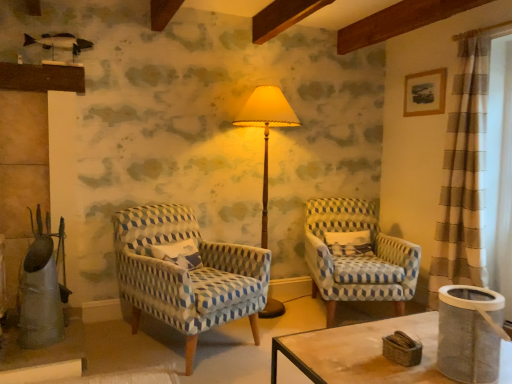
The height and width of the screenshot is (384, 512). What do you see at coordinates (357, 256) in the screenshot?
I see `blue patterned fabric chair at center, which is the second chair from left to right` at bounding box center [357, 256].

What is the approximate width of white textured pillow at center?

It is 4.89 inches.

What is the approximate width of white mesh screen at right?

white mesh screen at right is 28.78 centimeters in width.

This screenshot has height=384, width=512. Identify the location of white mesh screen at right. (499, 172).

The image size is (512, 384). In order to click on blue patterned fabric chair at center, marked as the 1th chair in a left-to-right arrangement in this screenshot , I will do `click(187, 274)`.

The height and width of the screenshot is (384, 512). Describe the element at coordinates (187, 274) in the screenshot. I see `blue patterned fabric chair at center, which is the second chair in right-to-left order` at that location.

Where is `blue patterned fabric chair at center, which is the second chair from left to right`? Image resolution: width=512 pixels, height=384 pixels. blue patterned fabric chair at center, which is the second chair from left to right is located at coordinates (357, 256).

From a real-world perspective, is blue patterned fabric chair at center, which is the second chair from left to right, beneath white textured pillow at center?

Yes, from a real-world perspective, blue patterned fabric chair at center, which is the second chair from left to right, is under white textured pillow at center.

Which is in front, point (397, 251) or point (333, 239)?

Point (397, 251)

In terms of width, does blue patterned fabric chair at center, which is the second chair from left to right, look wider or thinner when compared to white textured pillow at center?

Considering their sizes, blue patterned fabric chair at center, which is the second chair from left to right, looks broader than white textured pillow at center.

Which object is closer to the camera, blue patterned fabric chair at center, which is the second chair from left to right, or white textured pillow at center?

blue patterned fabric chair at center, which is the second chair from left to right, is in front.

Does white textured pillow at center come in front of white mesh screen at right?

That is False.

From the image's perspective, is white textured pillow at center positioned above or below white mesh screen at right?

From the image's perspective, white textured pillow at center appears below white mesh screen at right.

Considering the positions of point (362, 253) and point (500, 83), is point (362, 253) closer or farther from the camera than point (500, 83)?

Clearly, point (362, 253) is more distant from the camera than point (500, 83).

Could you tell me if blue patterned fabric chair at center, the 1th chair in the right-to-left sequence, is turned towards matte yellow fabric lampshade at center?

No, blue patterned fabric chair at center, the 1th chair in the right-to-left sequence, is not turned towards matte yellow fabric lampshade at center.

How far apart are blue patterned fabric chair at center, which is the second chair from left to right, and matte yellow fabric lampshade at center?

31.91 inches.

Between blue patterned fabric chair at center, which is the second chair from left to right, and matte yellow fabric lampshade at center, which one is positioned behind?

blue patterned fabric chair at center, which is the second chair from left to right, is further away from the camera.

From a real-world perspective, is blue patterned fabric chair at center, which is the second chair from left to right, positioned under matte yellow fabric lampshade at center based on gravity?

Indeed, from a real-world perspective, blue patterned fabric chair at center, which is the second chair from left to right, is positioned beneath matte yellow fabric lampshade at center.

Is matte yellow fabric lampshade at center next to blue patterned fabric chair at center, the 1th chair in the right-to-left sequence, and touching it?

matte yellow fabric lampshade at center and blue patterned fabric chair at center, the 1th chair in the right-to-left sequence, are not in contact.

What's the angular difference between matte yellow fabric lampshade at center and blue patterned fabric chair at center, which is the second chair from left to right,'s facing directions?

The angular difference between matte yellow fabric lampshade at center and blue patterned fabric chair at center, which is the second chair from left to right, is 22.1 degrees.

From a real-world perspective, which object rests below the other?

blue patterned fabric chair at center, which is the second chair from left to right, from a real-world perspective.

Based on the photo, is white textured pillow at center turned away from blue patterned fabric chair at center, which is the second chair in right-to-left order?

No, blue patterned fabric chair at center, which is the second chair in right-to-left order, is not at the back of white textured pillow at center.

Does point (355, 236) come in front of point (162, 269)?

That is False.

Looking at the image, does white textured pillow at center seem bigger or smaller compared to blue patterned fabric chair at center, marked as the 1th chair in a left-to-right arrangement?

white textured pillow at center is smaller than blue patterned fabric chair at center, marked as the 1th chair in a left-to-right arrangement.

Is matte yellow fabric lampshade at center next to blue patterned fabric chair at center, marked as the 1th chair in a left-to-right arrangement?

No, matte yellow fabric lampshade at center is not touching blue patterned fabric chair at center, marked as the 1th chair in a left-to-right arrangement.

From a real-world perspective, which object stands above the other?

In real-world perspective, matte yellow fabric lampshade at center is above.

Based on the photo, is matte yellow fabric lampshade at center thinner than blue patterned fabric chair at center, which is the second chair in right-to-left order?

Correct, the width of matte yellow fabric lampshade at center is less than that of blue patterned fabric chair at center, which is the second chair in right-to-left order.

Is matte yellow fabric lampshade at center smaller than blue patterned fabric chair at center, which is the second chair in right-to-left order?

Correct, matte yellow fabric lampshade at center occupies less space than blue patterned fabric chair at center, which is the second chair in right-to-left order.

From the picture: Who is bigger, white mesh screen at right or white textured pillow at center?

white mesh screen at right.

Is white mesh screen at right positioned before white textured pillow at center?

Yes.

Could you tell me if white mesh screen at right is turned towards white textured pillow at center?

No, white mesh screen at right does not turn towards white textured pillow at center.

Locate an element on the screen. The image size is (512, 384). pillow above the blue patterned fabric chair at center, the 1th chair in the right-to-left sequence (from the image's perspective) is located at coordinates (349, 243).

Find the location of a particular element. pillow below the white mesh screen at right (from a real-world perspective) is located at coordinates (349, 243).

Looking at the image, which one is located further to white mesh screen at right, blue patterned fabric chair at center, marked as the 1th chair in a left-to-right arrangement, or matte yellow fabric lampshade at center?

The object further to white mesh screen at right is blue patterned fabric chair at center, marked as the 1th chair in a left-to-right arrangement.

Consider the image. Estimate the real-world distances between objects in this image. Which object is closer to white mesh screen at right, white textured pillow at center or matte yellow fabric lampshade at center?

white textured pillow at center lies closer to white mesh screen at right than the other object.

Looking at this image, which object lies further to the anchor point blue patterned fabric chair at center, the 1th chair in the right-to-left sequence, white textured pillow at center or blue patterned fabric chair at center, marked as the 1th chair in a left-to-right arrangement?

blue patterned fabric chair at center, marked as the 1th chair in a left-to-right arrangement, lies further to blue patterned fabric chair at center, the 1th chair in the right-to-left sequence, than the other object.

Estimate the real-world distances between objects in this image. Which object is closer to matte yellow fabric lampshade at center, blue patterned fabric chair at center, the 1th chair in the right-to-left sequence, or white textured pillow at center?

Among the two, blue patterned fabric chair at center, the 1th chair in the right-to-left sequence, is located nearer to matte yellow fabric lampshade at center.

Based on their spatial positions, is matte yellow fabric lampshade at center or white textured pillow at center closer to blue patterned fabric chair at center, marked as the 1th chair in a left-to-right arrangement?

Based on the image, matte yellow fabric lampshade at center appears to be nearer to blue patterned fabric chair at center, marked as the 1th chair in a left-to-right arrangement.

From the image, which object appears to be nearer to matte yellow fabric lampshade at center, blue patterned fabric chair at center, the 1th chair in the right-to-left sequence, or blue patterned fabric chair at center, which is the second chair in right-to-left order?

The object closer to matte yellow fabric lampshade at center is blue patterned fabric chair at center, the 1th chair in the right-to-left sequence.

Based on their spatial positions, is white mesh screen at right or blue patterned fabric chair at center, which is the second chair from left to right, further from white textured pillow at center?

white mesh screen at right is further to white textured pillow at center.

Which object lies further to the anchor point matte yellow fabric lampshade at center, white mesh screen at right or white textured pillow at center?

white mesh screen at right is further to matte yellow fabric lampshade at center.

Locate an element on the screen. This screenshot has height=384, width=512. chair located between white textured pillow at center and white mesh screen at right in the left-right direction is located at coordinates (357, 256).

This screenshot has height=384, width=512. I want to click on lamp situated between blue patterned fabric chair at center, marked as the 1th chair in a left-to-right arrangement, and blue patterned fabric chair at center, which is the second chair from left to right, from left to right, so click(x=266, y=131).

Image resolution: width=512 pixels, height=384 pixels. Find the location of `pillow situated between blue patterned fabric chair at center, marked as the 1th chair in a left-to-right arrangement, and white mesh screen at right from left to right`. pillow situated between blue patterned fabric chair at center, marked as the 1th chair in a left-to-right arrangement, and white mesh screen at right from left to right is located at coordinates (349, 243).

This screenshot has width=512, height=384. What are the coordinates of `lamp positioned between blue patterned fabric chair at center, marked as the 1th chair in a left-to-right arrangement, and white textured pillow at center from near to far` in the screenshot? It's located at (266, 131).